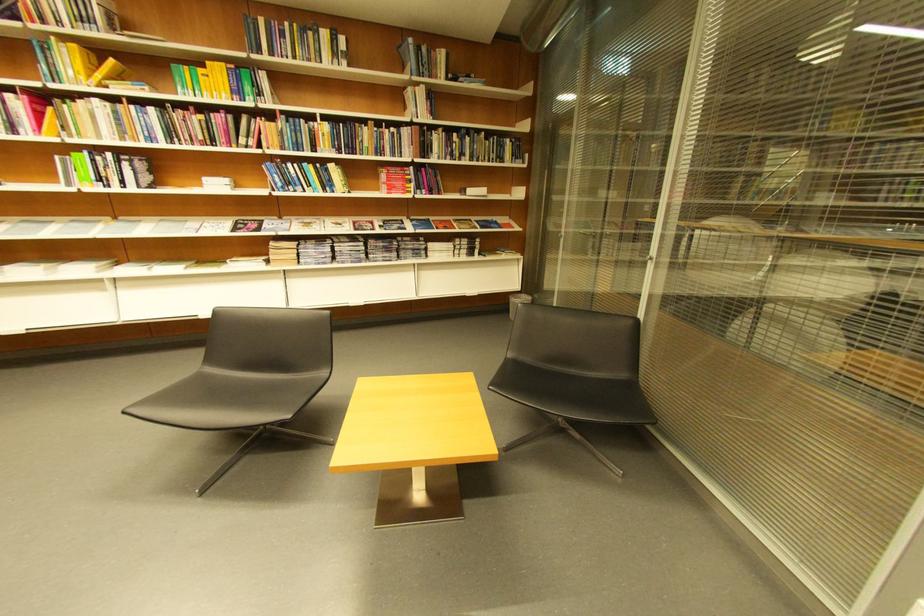
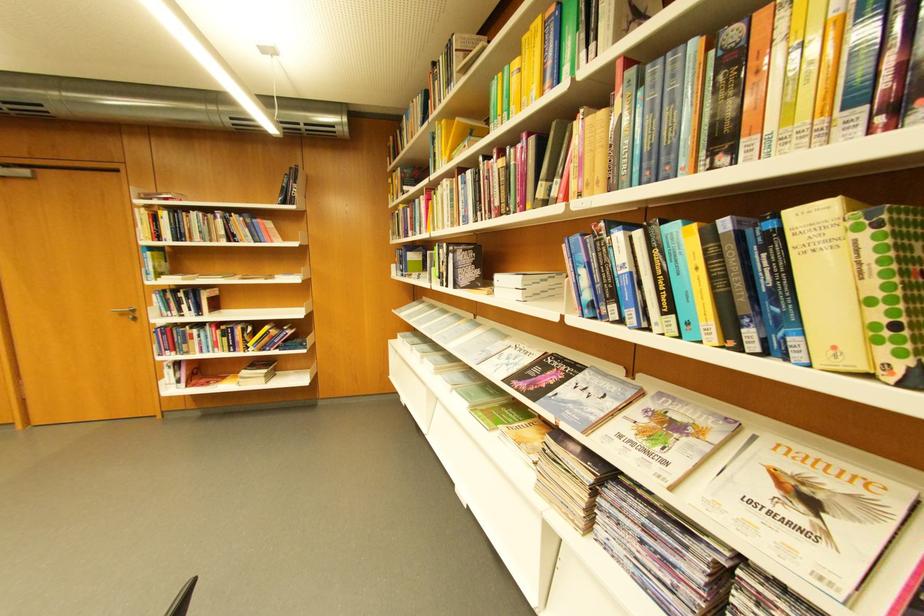
Where in the second image is the point corresponding to (112,180) from the first image?

(451, 278)